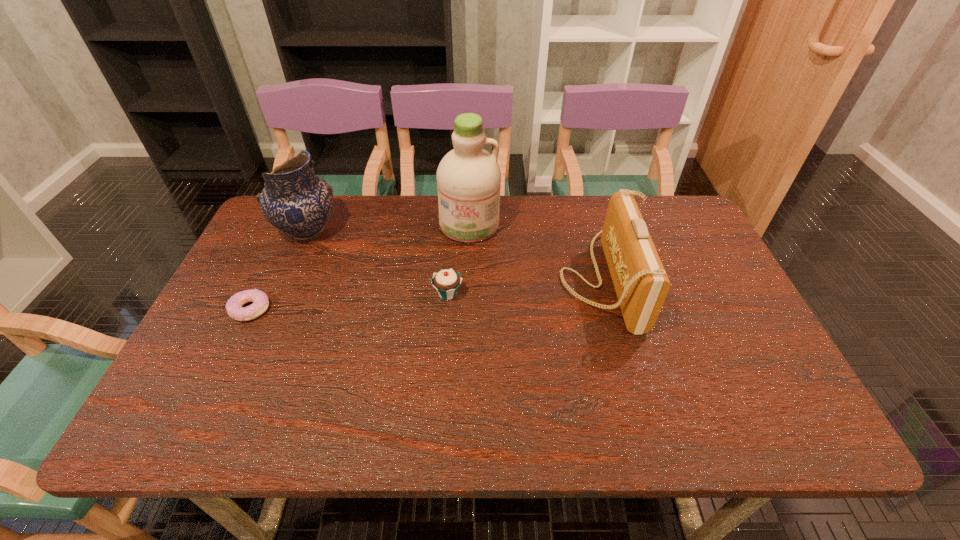
You are a GUI agent. You are given a task and a screenshot of the screen. Output one action in this format:
    pyautogui.click(x=<x>, y=<y>)
    Task: Click on the vacant area between the doughnut and the second shortest object
    
    Given the screenshot: What is the action you would take?
    point(348,302)

Find the location of `free space between the tallest object and the shortest object`. free space between the tallest object and the shortest object is located at coordinates (360, 267).

This screenshot has width=960, height=540. I want to click on empty location between the tallest object and the doughnut, so click(x=360, y=267).

Locate which object is the third closest to the second shortest object. Please provide its 2D coordinates. Your answer should be formatted as a tuple, i.e. [(x, y)], where the tuple contains the x and y coordinates of a point satisfying the conditions above.

[(296, 201)]

The width and height of the screenshot is (960, 540). What are the coordinates of `object identified as the fourth closest to the cupcake` in the screenshot? It's located at (234, 308).

The height and width of the screenshot is (540, 960). Identify the location of vacant space that satisfies the following two spatial constraints: 1. on the decorative side of the handbag; 2. on the front side of the shortest object. (610, 309).

Find the location of `vacant space that satisfies the following two spatial constraints: 1. on the back side of the doughnut; 2. on the left side of the fourth shortest object`. vacant space that satisfies the following two spatial constraints: 1. on the back side of the doughnut; 2. on the left side of the fourth shortest object is located at coordinates (288, 231).

Locate an element on the screen. free space in the image that satisfies the following two spatial constraints: 1. on the back side of the cupcake; 2. on the right side of the shortest object is located at coordinates (257, 294).

Identify the location of free space that satisfies the following two spatial constraints: 1. on the decorative side of the third tallest object; 2. on the front side of the cupcake. This screenshot has width=960, height=540. (606, 294).